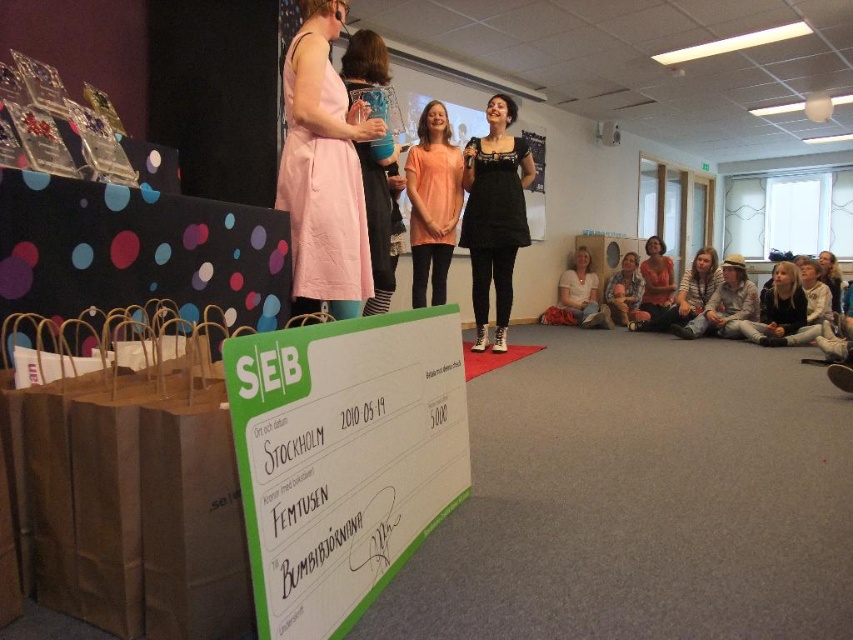
In order to click on pink fabric dress at upper left in this screenshot , I will do `click(323, 170)`.

Is pink fabric dress at upper left in front of striped sweater at lower right?

That is True.

Is point (328, 26) positioned behind point (679, 296)?

That is False.

This screenshot has height=640, width=853. Identify the location of pink fabric dress at upper left. (323, 170).

Is black matte dress at center positioned before matte peach t-shirt at center?

That is False.

Does black matte dress at center appear over matte peach t-shirt at center?

No, black matte dress at center is not above matte peach t-shirt at center.

Is point (479, 198) more distant than point (415, 172)?

Yes, point (479, 198) is behind point (415, 172).

At what (x,y) coordinates should I click in order to perform the action: click on black matte dress at center. Please return your answer as a coordinate pair (x, y). The image size is (853, 640). Looking at the image, I should click on (494, 216).

Between black matte dress at center and matte pink dress at lower center, which one has less height?

Standing shorter between the two is matte pink dress at lower center.

Does black matte dress at center have a smaller size compared to matte pink dress at lower center?

Indeed, black matte dress at center has a smaller size compared to matte pink dress at lower center.

Which is in front, point (521, 172) or point (663, 268)?

Point (521, 172) is in front.

Locate an element on the screen. The width and height of the screenshot is (853, 640). black matte dress at center is located at coordinates (494, 216).